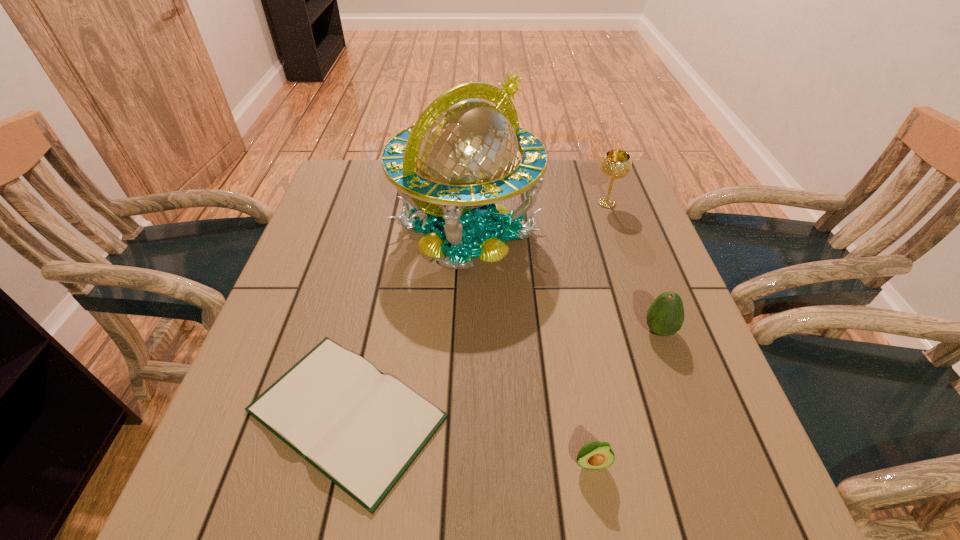
Find the location of `the tallest object`. the tallest object is located at coordinates (461, 155).

The height and width of the screenshot is (540, 960). I want to click on chalice, so click(x=615, y=164).

Locate an element on the screen. the taller avocado is located at coordinates (665, 316).

Identify the location of the farther avocado. (665, 316).

Find the location of `the nearer avocado`. the nearer avocado is located at coordinates (593, 455).

Locate an element on the screen. The height and width of the screenshot is (540, 960). the shorter avocado is located at coordinates (593, 455).

The height and width of the screenshot is (540, 960). I want to click on hardback book, so click(x=362, y=429).

Locate an element on the screen. The height and width of the screenshot is (540, 960). vacant space located on the front of the tallest object is located at coordinates (465, 304).

This screenshot has height=540, width=960. I want to click on blank area located on the back of the chalice, so click(x=593, y=164).

Locate an element on the screen. This screenshot has height=540, width=960. vacant position located on the back of the taller avocado is located at coordinates (622, 229).